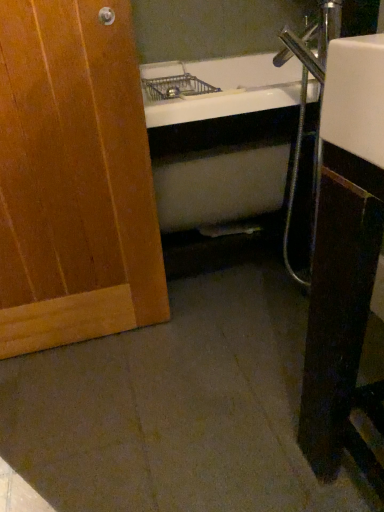
Measure the distance between point (32, 269) and camera.

Point (32, 269) and camera are 1.21 meters apart.

What is the approximate height of wooden door at left?

wooden door at left is 36.85 inches in height.

What do you see at coordinates (74, 178) in the screenshot?
I see `wooden door at left` at bounding box center [74, 178].

What are the coordinates of `wooden door at left` in the screenshot? It's located at (74, 178).

You are a GUI agent. You are given a task and a screenshot of the screen. Output one action in this format:
    pyautogui.click(x=<x>, y=<y>)
    Task: Click on the wooden door at left
    The width and height of the screenshot is (384, 512).
    Given the screenshot: What is the action you would take?
    pyautogui.click(x=74, y=178)